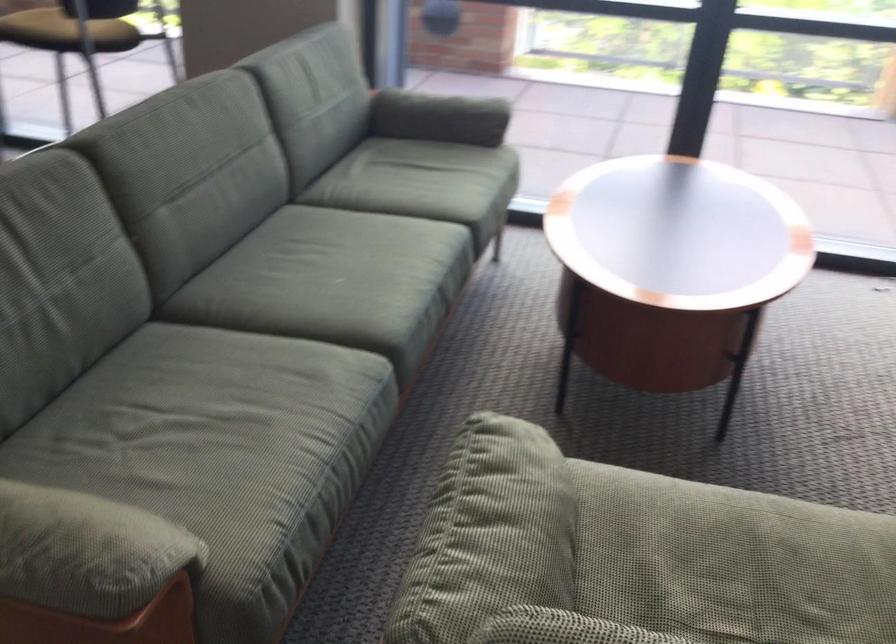
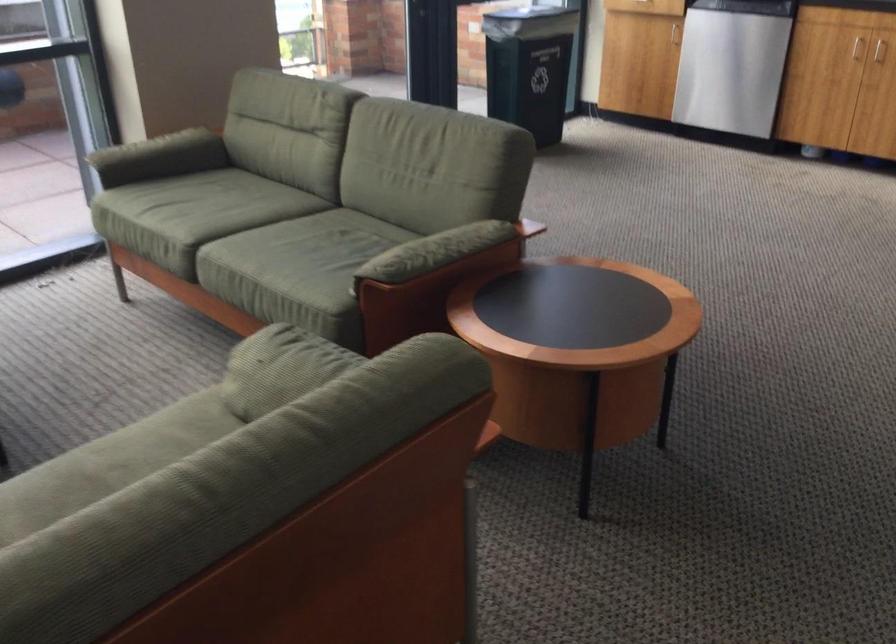
Question: Based on the continuous images, in which direction is the camera rotating? Reply with the corresponding letter.

Choices:
 (A) Left
 (B) Right
 (C) Up
 (D) Down

Answer: (B)